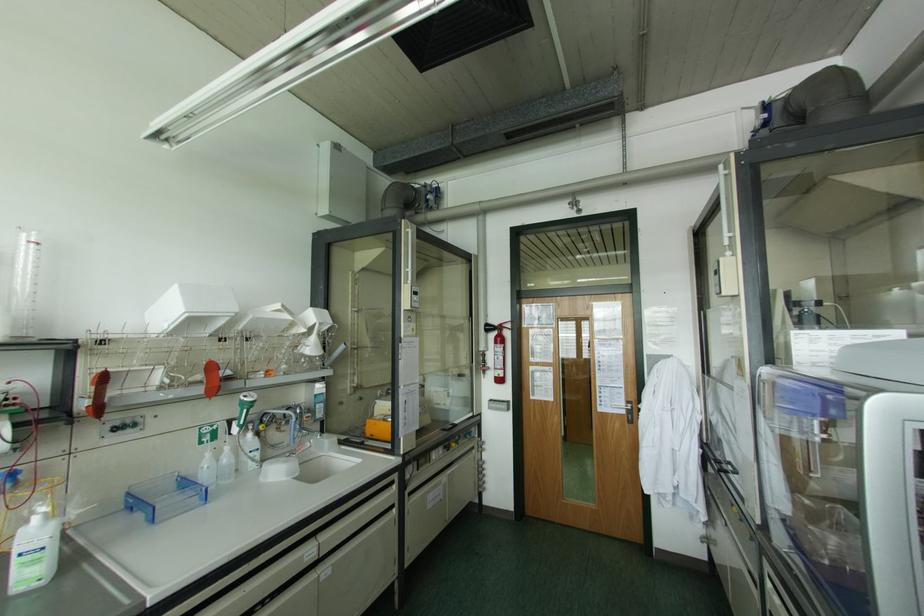
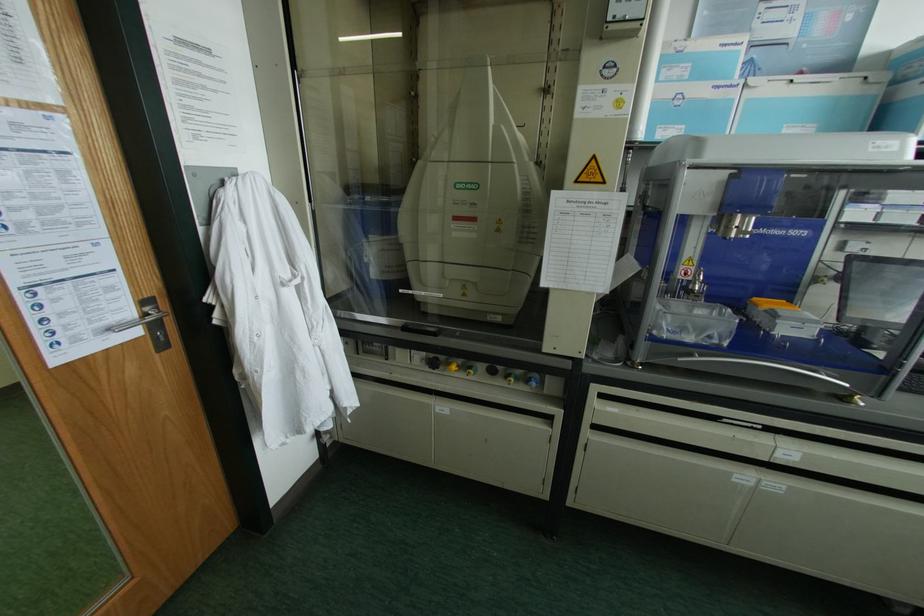
Where in the second image is the point corresponding to pixel 626 400 from the first image?

(142, 302)